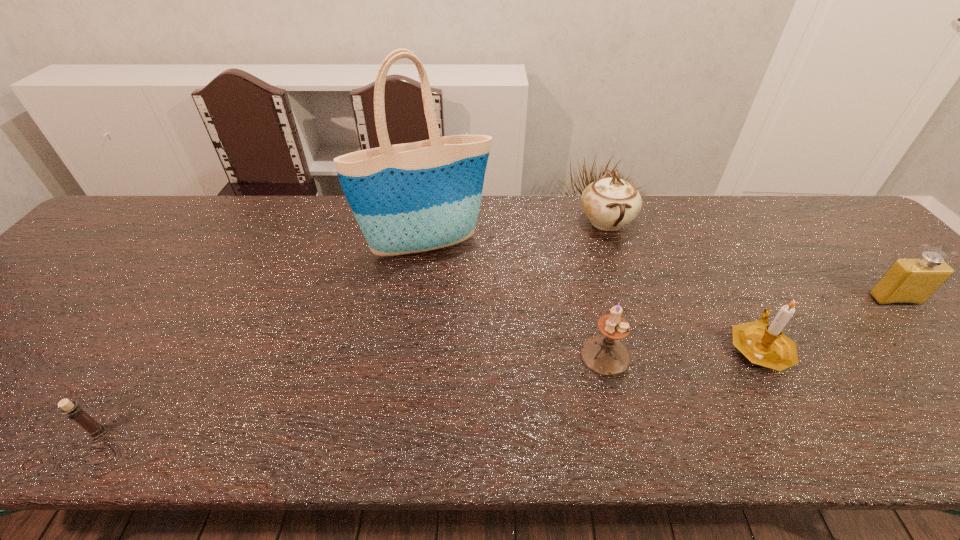
Image resolution: width=960 pixels, height=540 pixels. Identify the location of free region located on the front of the chinaware. (634, 303).

Identify the location of free space located on the front-facing side of the fourth nearest object. The height and width of the screenshot is (540, 960). (934, 343).

Image resolution: width=960 pixels, height=540 pixels. I want to click on free space located 0.060m on the left of the second candle holder from left to right, so (x=553, y=355).

At what (x,y) coordinates should I click in order to perform the action: click on free location located on the back of the rightmost candle holder. Please return your answer as a coordinate pair (x, y). Looking at the image, I should click on (688, 221).

Image resolution: width=960 pixels, height=540 pixels. Find the location of `free space located 0.190m on the right of the shortest object`. free space located 0.190m on the right of the shortest object is located at coordinates (207, 433).

I want to click on tote bag present at the far edge, so [408, 198].

Image resolution: width=960 pixels, height=540 pixels. What are the coordinates of `chinaware present at the far edge` in the screenshot? It's located at (610, 203).

This screenshot has width=960, height=540. Identify the location of object present at the near edge. (73, 411).

Locate an element on the screen. This screenshot has width=960, height=540. object present at the right edge is located at coordinates (909, 280).

Find the location of a particular element. vacant space at the far edge of the desktop is located at coordinates (204, 242).